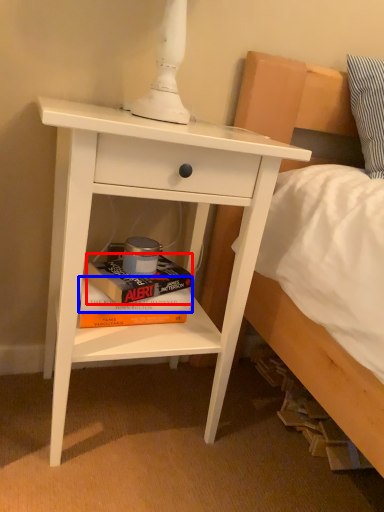
Question: Among these objects, which one is farthest to the camera, paperback book (highlighted by a red box) or paperback book (highlighted by a blue box)?

Choices:
 (A) paperback book
 (B) paperback book

Answer: (B)